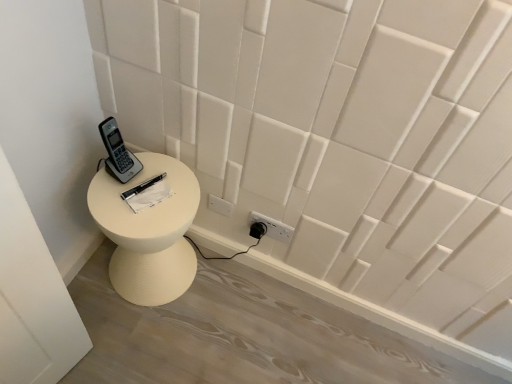
Identify the location of vacant space in front of white matte side table at lower left. The image size is (512, 384). (132, 336).